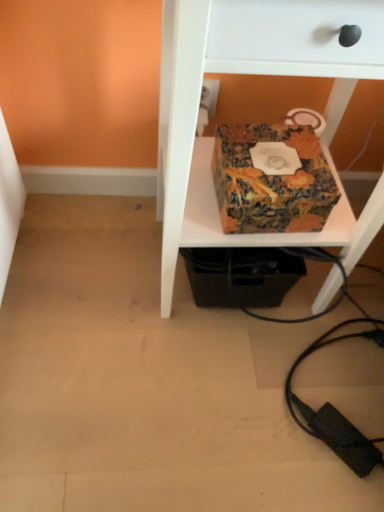
The width and height of the screenshot is (384, 512). What do you see at coordinates (271, 182) in the screenshot?
I see `marbled paper box at center` at bounding box center [271, 182].

The width and height of the screenshot is (384, 512). In order to click on marbled paper box at center in this screenshot , I will do 271,182.

The image size is (384, 512). I want to click on multicolored fabric box at center, so click(x=259, y=74).

What do you see at coordinates (259, 74) in the screenshot? This screenshot has height=512, width=384. I see `multicolored fabric box at center` at bounding box center [259, 74].

In order to click on marbled paper box at center in this screenshot , I will do `click(271, 182)`.

Can you confirm if marbled paper box at center is positioned to the right of multicolored fabric box at center?

Incorrect, marbled paper box at center is not on the right side of multicolored fabric box at center.

In the image, is marbled paper box at center positioned in front of or behind multicolored fabric box at center?

Clearly, marbled paper box at center is behind multicolored fabric box at center.

Between point (281, 214) and point (162, 179), which one is positioned in front?

Point (281, 214)

From the image's perspective, relative to multicolored fabric box at center, is marbled paper box at center above or below?

marbled paper box at center is situated lower than multicolored fabric box at center in the image.

From a real-world perspective, relative to multicolored fabric box at center, is marbled paper box at center vertically above or below?

In terms of real-world spatial position, marbled paper box at center is below multicolored fabric box at center.

Can you confirm if marbled paper box at center is thinner than multicolored fabric box at center?

Yes, marbled paper box at center is thinner than multicolored fabric box at center.

In terms of height, does marbled paper box at center look taller or shorter compared to multicolored fabric box at center?

marbled paper box at center is shorter than multicolored fabric box at center.

Who is bigger, marbled paper box at center or multicolored fabric box at center?

multicolored fabric box at center.

Looking at this image, can we say marbled paper box at center lies outside multicolored fabric box at center?

No.

Is marbled paper box at center touching multicolored fabric box at center?

No, marbled paper box at center is not making contact with multicolored fabric box at center.

Is marbled paper box at center facing towards multicolored fabric box at center?

Yes, marbled paper box at center faces towards multicolored fabric box at center.

You are a GUI agent. You are given a task and a screenshot of the screen. Output one action in this format:
    pyautogui.click(x=<x>, y=<y>)
    Task: Click on the furniture that appears above the marbled paper box at center (from the image's perspective)
    
    Given the screenshot: What is the action you would take?
    pyautogui.click(x=259, y=74)

Between multicolored fabric box at center and marbled paper box at center, which one appears on the right side from the viewer's perspective?

multicolored fabric box at center is more to the right.

Is the depth of multicolored fabric box at center less than that of marbled paper box at center?

Yes.

Considering the points (162, 300) and (296, 189), which point is in front, point (162, 300) or point (296, 189)?

The point (296, 189) is more forward.

From the image's perspective, between multicolored fabric box at center and marbled paper box at center, who is located below?

marbled paper box at center.

From a real-world perspective, does multicolored fabric box at center sit lower than marbled paper box at center?

No, from a real-world perspective, multicolored fabric box at center is not under marbled paper box at center.

Is multicolored fabric box at center thinner than marbled paper box at center?

No, multicolored fabric box at center is not thinner than marbled paper box at center.

Who is taller, multicolored fabric box at center or marbled paper box at center?

With more height is multicolored fabric box at center.

Can you confirm if multicolored fabric box at center is smaller than marbled paper box at center?

Actually, multicolored fabric box at center might be larger than marbled paper box at center.

Is multicolored fabric box at center inside or outside of marbled paper box at center?

multicolored fabric box at center is not enclosed by marbled paper box at center.

Would you consider multicolored fabric box at center to be distant from marbled paper box at center?

multicolored fabric box at center is near marbled paper box at center, not far away.

Is multicolored fabric box at center oriented away from marbled paper box at center?

Yes, marbled paper box at center is at the back of multicolored fabric box at center.

Identify the location of box lying on the left of multicolored fabric box at center. This screenshot has width=384, height=512. (271, 182).

At what (x,y) coordinates should I click in order to perform the action: click on box that appears behind the multicolored fabric box at center. Please return your answer as a coordinate pair (x, y). Looking at the image, I should click on (271, 182).

The width and height of the screenshot is (384, 512). In order to click on box that appears on the left of multicolored fabric box at center in this screenshot , I will do (x=271, y=182).